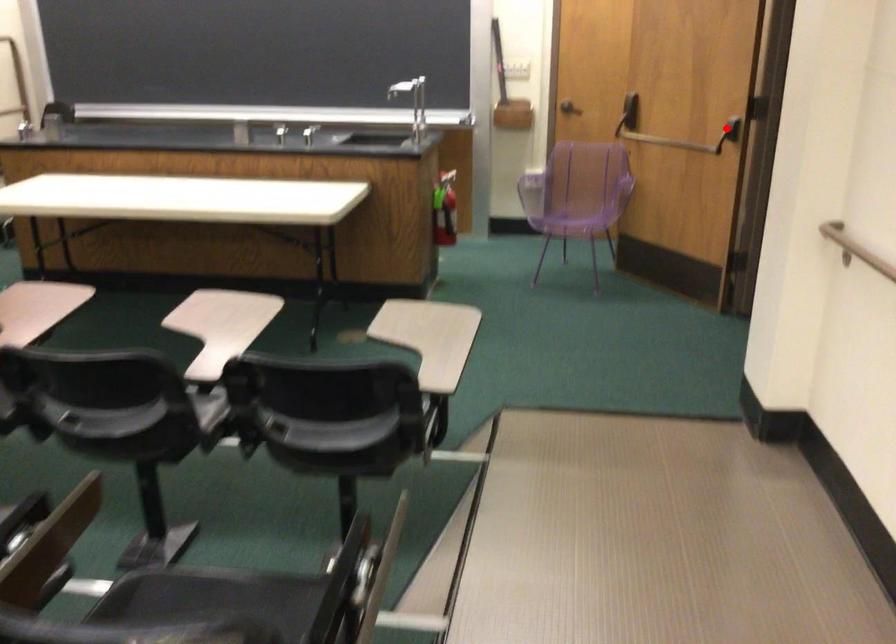
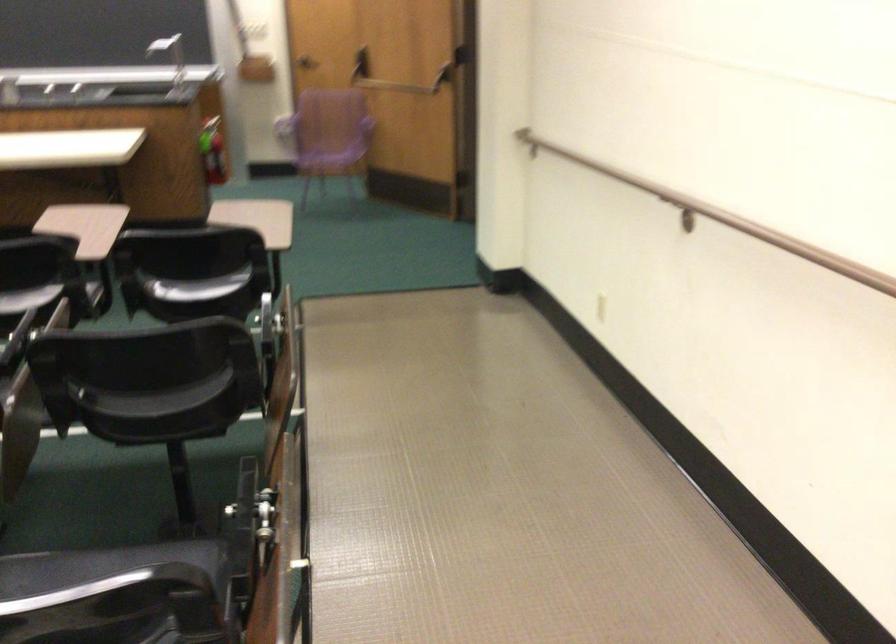
In the second image, find the point that corresponds to the highlighted location in the first image.

(444, 78)